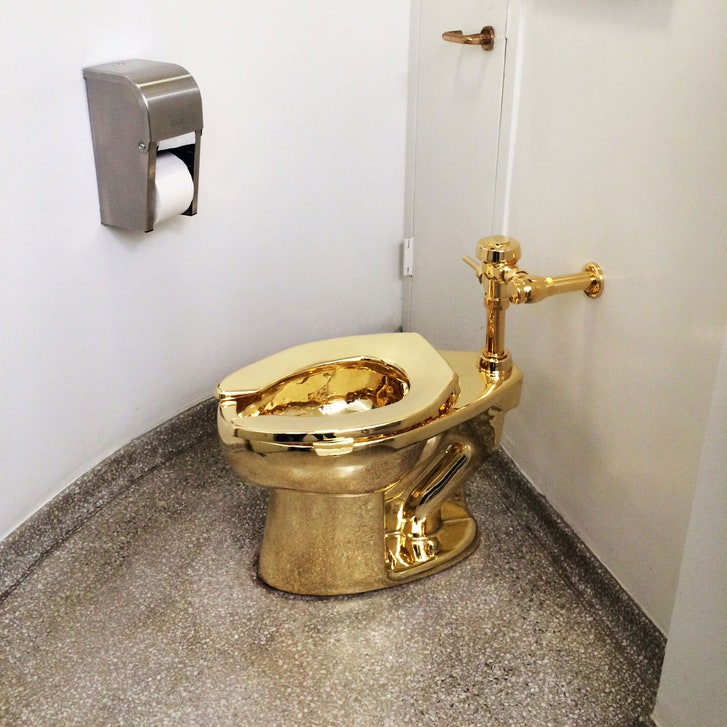
Identify the location of toilet. The height and width of the screenshot is (727, 727). (377, 469).